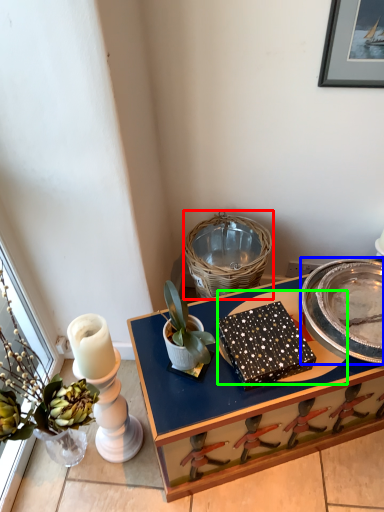
Question: Estimate the real-world distances between objects in this image. Which object is closer to basket (highlighted by a red box), plate (highlighted by a blue box) or glass plate (highlighted by a green box)?

Choices:
 (A) plate
 (B) glass plate

Answer: (B)